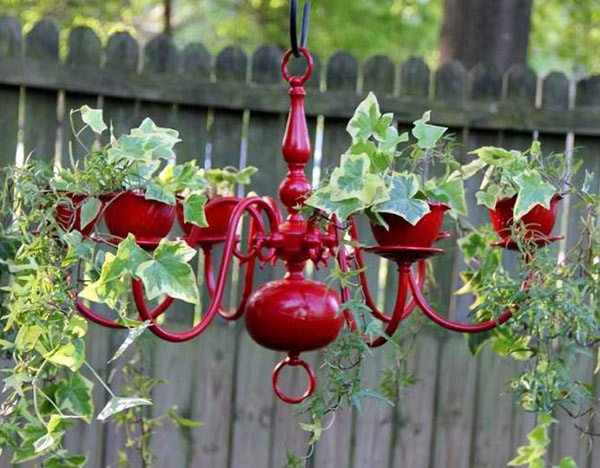
Where is `cup`? cup is located at coordinates (147, 240).